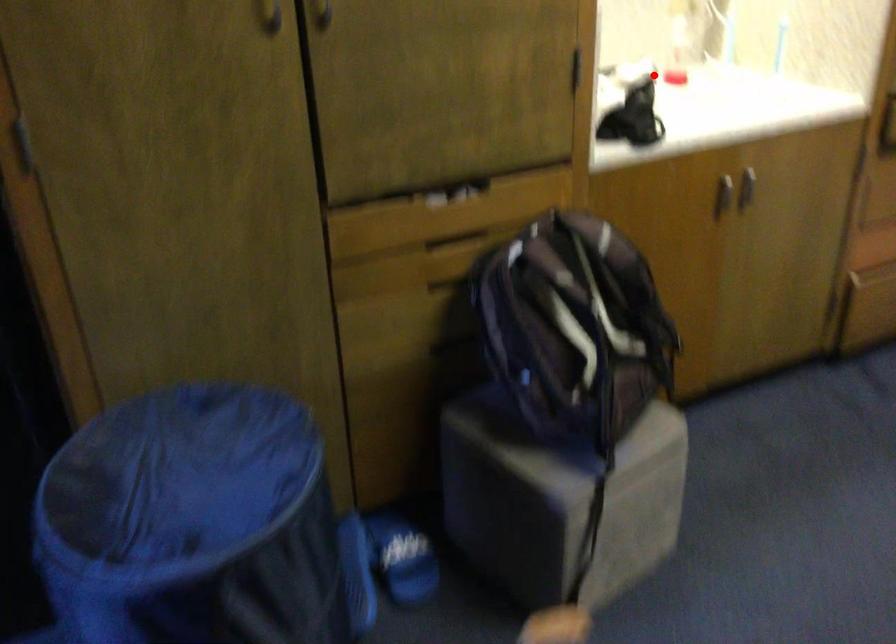
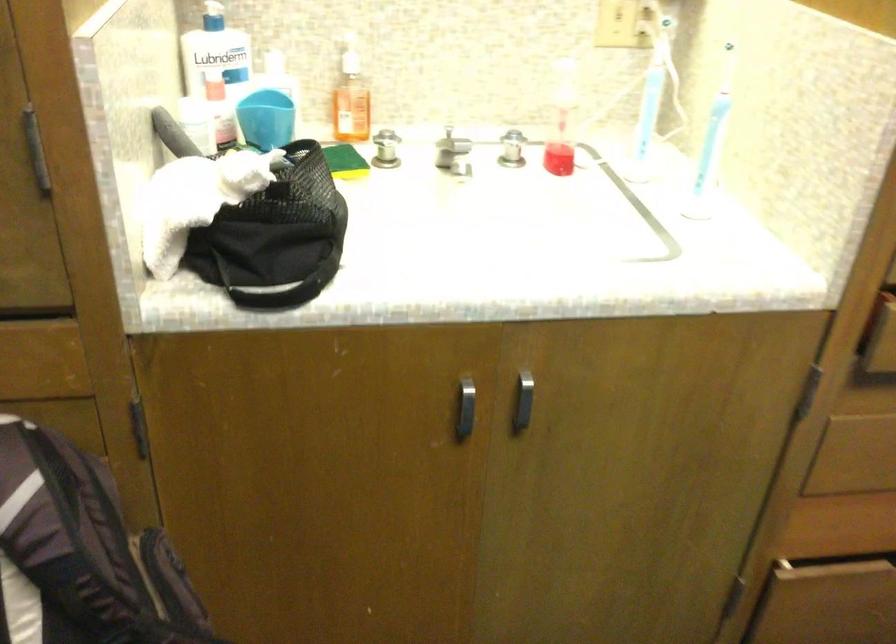
Question: I am providing you with two images of the same scene from different viewpoints. In image1, a red point is highlighted. Considering the same 3D point in image2, which of the following is correct?

Choices:
 (A) It is closer
 (B) It is farther

Answer: (A)